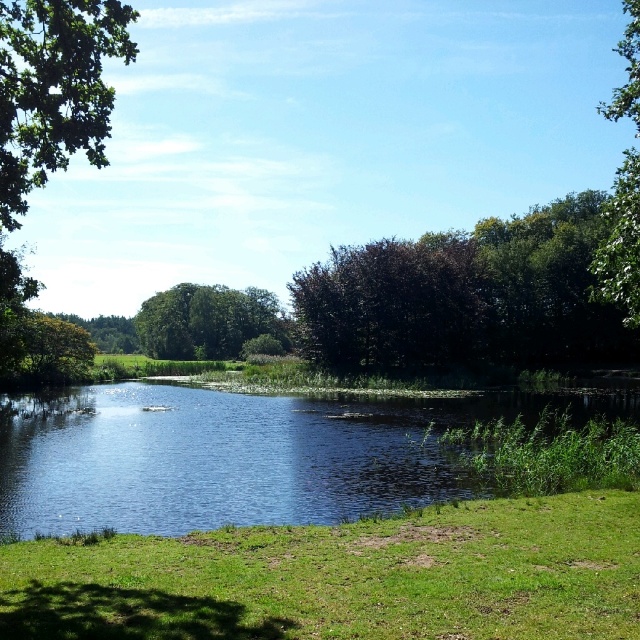
Which is more to the right, clear blue water at center or green leafy tree at upper left?

clear blue water at center

Between clear blue water at center and green leafy tree at upper left, which one has less height?

clear blue water at center

Is point (45, 406) positioned after point (52, 145)?

Yes, it is.

Where is `clear blue water at center`? This screenshot has width=640, height=640. clear blue water at center is located at coordinates (237, 454).

Which is below, green leafy tree at upper left or green leafy tree at upper right?

Positioned lower is green leafy tree at upper left.

Is point (33, 8) positioned after point (637, 77)?

No, (33, 8) is closer to viewer.

Image resolution: width=640 pixels, height=640 pixels. In order to click on green leafy tree at upper left in this screenshot , I will do `click(54, 88)`.

Locate an element on the screen. This screenshot has width=640, height=640. green leafy tree at upper left is located at coordinates (54, 88).

Does point (628, 548) lie in front of point (40, 124)?

Yes, point (628, 548) is in front of point (40, 124).

Is green grassy at lower center above green leafy tree at upper left?

Actually, green grassy at lower center is below green leafy tree at upper left.

I want to click on green grassy at lower center, so click(346, 577).

This screenshot has height=640, width=640. What are the coordinates of `green grassy at lower center` in the screenshot? It's located at (346, 577).